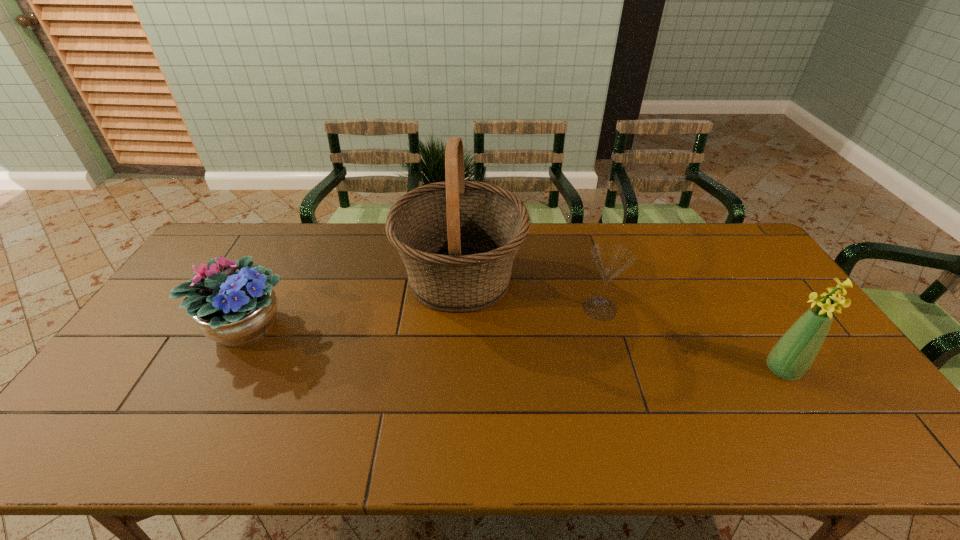
The width and height of the screenshot is (960, 540). I want to click on basket, so click(x=458, y=239).

Where is `the third object from right to left`? Image resolution: width=960 pixels, height=540 pixels. the third object from right to left is located at coordinates (458, 239).

Identify the location of the second tallest object. (794, 353).

Locate an element on the screen. This screenshot has width=960, height=540. the rightmost object is located at coordinates (794, 353).

The height and width of the screenshot is (540, 960). I want to click on the left bouquet, so click(235, 309).

Where is `the shorter bouquet`? the shorter bouquet is located at coordinates (235, 309).

Image resolution: width=960 pixels, height=540 pixels. I want to click on the third object from left to right, so click(x=611, y=259).

Where is `free space located 0.310m on the left of the second object from left to right`? The height and width of the screenshot is (540, 960). free space located 0.310m on the left of the second object from left to right is located at coordinates (300, 279).

In order to click on vacant area situated on the front-facing side of the taller bouquet in this screenshot , I will do `click(711, 370)`.

This screenshot has width=960, height=540. What are the coordinates of `vacant space located 0.300m on the front-facing side of the taller bouquet` in the screenshot? It's located at (651, 370).